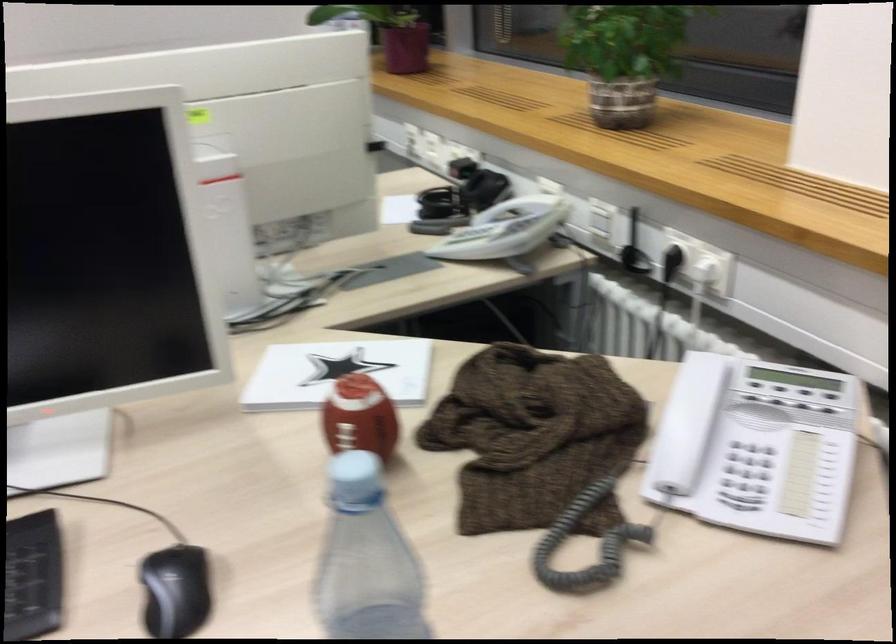
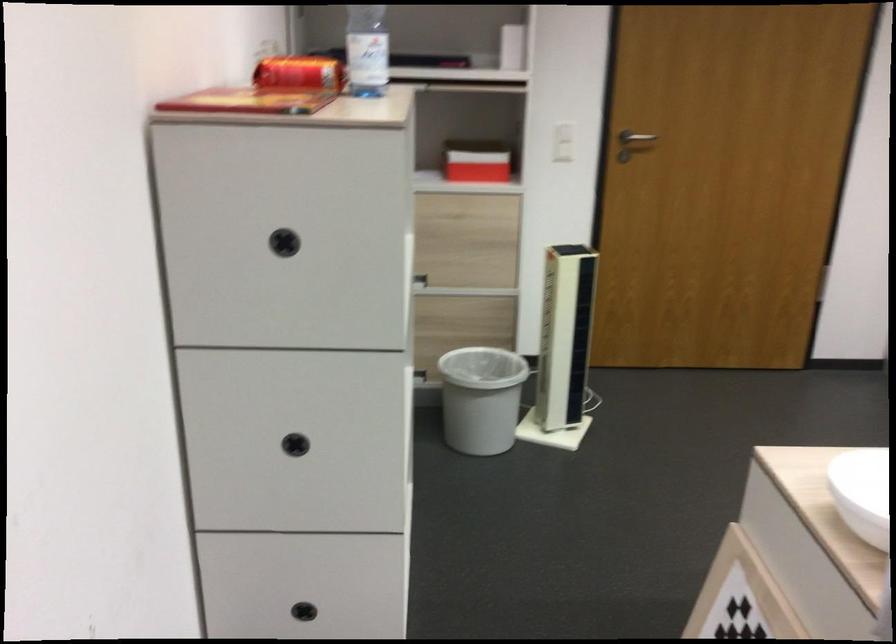
Based on the continuous images, in which direction is the camera rotating?

The rotation direction of the camera is left-down.